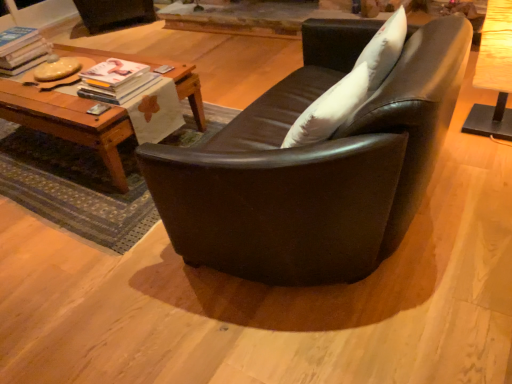
Image resolution: width=512 pixels, height=384 pixels. Identify the location of free spot to the left of matte black couch at center. (101, 279).